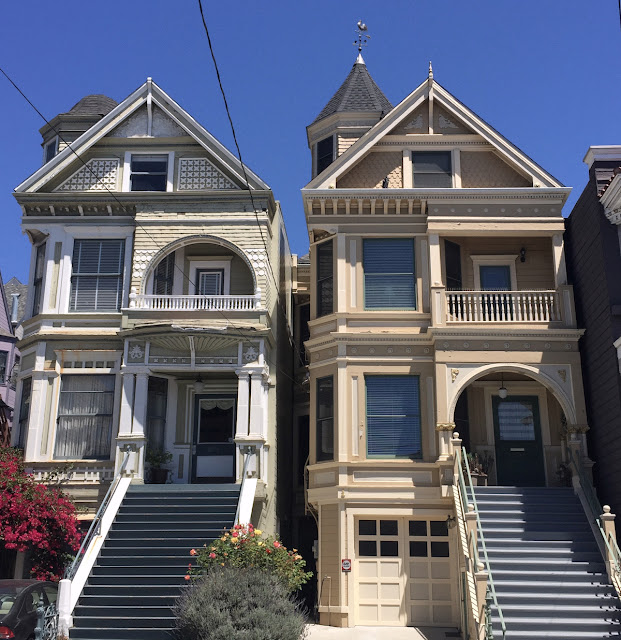
Locate an element on the screen. Image resolution: width=621 pixels, height=640 pixels. stairs is located at coordinates (146, 559).